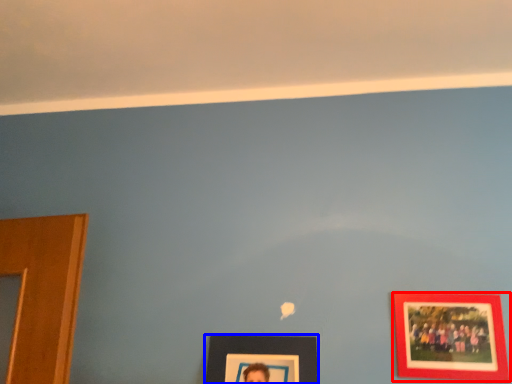
Question: Among these objects, which one is farthest to the camera, picture frame (highlighted by a red box) or picture frame (highlighted by a blue box)?

Choices:
 (A) picture frame
 (B) picture frame

Answer: (A)